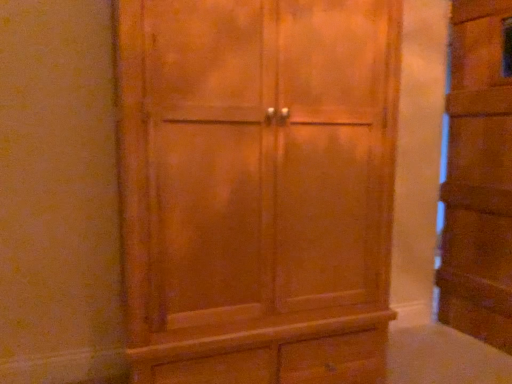
Question: Does matte wood cupboard at center, which is counted as the 1th cupboard, starting from the left, lie in front of wooden cabinet at right, placed as the 1th cupboard when sorted from right to left?

Choices:
 (A) yes
 (B) no

Answer: (A)

Question: Is matte wood cupboard at center, acting as the 2th cupboard starting from the right, turned away from wooden cabinet at right, placed as the second cupboard when sorted from left to right?

Choices:
 (A) no
 (B) yes

Answer: (A)

Question: Is the position of matte wood cupboard at center, acting as the 2th cupboard starting from the right, more distant than that of wooden cabinet at right, placed as the second cupboard when sorted from left to right?

Choices:
 (A) no
 (B) yes

Answer: (A)

Question: From the image's perspective, is matte wood cupboard at center, which is counted as the 1th cupboard, starting from the left, located above wooden cabinet at right, placed as the 1th cupboard when sorted from right to left?

Choices:
 (A) no
 (B) yes

Answer: (A)

Question: Is there a large distance between matte wood cupboard at center, which is counted as the 1th cupboard, starting from the left, and wooden cabinet at right, placed as the second cupboard when sorted from left to right?

Choices:
 (A) yes
 (B) no

Answer: (A)

Question: Does matte wood cupboard at center, which is counted as the 1th cupboard, starting from the left, have a lesser width compared to wooden cabinet at right, placed as the 1th cupboard when sorted from right to left?

Choices:
 (A) yes
 (B) no

Answer: (B)

Question: Is wooden cabinet at right, placed as the second cupboard when sorted from left to right, next to matte wood cupboard at center, acting as the 2th cupboard starting from the right, and touching it?

Choices:
 (A) no
 (B) yes

Answer: (A)

Question: Can matte wood cupboard at center, acting as the 2th cupboard starting from the right, be found inside wooden cabinet at right, placed as the second cupboard when sorted from left to right?

Choices:
 (A) no
 (B) yes

Answer: (A)

Question: From a real-world perspective, is wooden cabinet at right, placed as the second cupboard when sorted from left to right, physically below matte wood cupboard at center, which is counted as the 1th cupboard, starting from the left?

Choices:
 (A) yes
 (B) no

Answer: (B)

Question: Considering the relative sizes of wooden cabinet at right, placed as the 1th cupboard when sorted from right to left, and matte wood cupboard at center, which is counted as the 1th cupboard, starting from the left, in the image provided, is wooden cabinet at right, placed as the 1th cupboard when sorted from right to left, thinner than matte wood cupboard at center, which is counted as the 1th cupboard, starting from the left,?

Choices:
 (A) yes
 (B) no

Answer: (A)

Question: Considering the relative sizes of wooden cabinet at right, placed as the 1th cupboard when sorted from right to left, and matte wood cupboard at center, which is counted as the 1th cupboard, starting from the left, in the image provided, is wooden cabinet at right, placed as the 1th cupboard when sorted from right to left, wider than matte wood cupboard at center, which is counted as the 1th cupboard, starting from the left,?

Choices:
 (A) yes
 (B) no

Answer: (B)

Question: Can you confirm if wooden cabinet at right, placed as the 1th cupboard when sorted from right to left, is bigger than matte wood cupboard at center, which is counted as the 1th cupboard, starting from the left?

Choices:
 (A) yes
 (B) no

Answer: (B)

Question: Considering the positions of wooden cabinet at right, placed as the 1th cupboard when sorted from right to left, and matte wood cupboard at center, which is counted as the 1th cupboard, starting from the left, in the image, is wooden cabinet at right, placed as the 1th cupboard when sorted from right to left, bigger or smaller than matte wood cupboard at center, which is counted as the 1th cupboard, starting from the left,?

Choices:
 (A) small
 (B) big

Answer: (A)